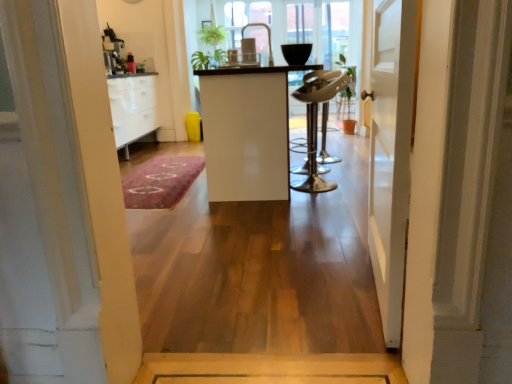
Measure the distance between white wooden door at center and camera.

1.20 meters.

What do you see at coordinates (161, 181) in the screenshot? This screenshot has width=512, height=384. I see `pink carpet at center` at bounding box center [161, 181].

This screenshot has height=384, width=512. Identify the location of shiny metallic bar stool at center. (316, 120).

Find the location of a particular element. This screenshot has height=384, width=512. furniture lying above the shiny metallic bar stool at center (from the image's perspective) is located at coordinates (247, 131).

Considering the relative sizes of shiny metallic bar stool at center and white glossy cabinet at center in the image provided, is shiny metallic bar stool at center wider than white glossy cabinet at center?

No, shiny metallic bar stool at center is not wider than white glossy cabinet at center.

What's the angular difference between shiny metallic bar stool at center and white glossy cabinet at center's facing directions?

179 degrees separate the facing orientations of shiny metallic bar stool at center and white glossy cabinet at center.

Does point (314, 150) come farther from viewer compared to point (240, 83)?

Yes, point (314, 150) is farther from viewer.

Considering the positions of point (186, 158) and point (388, 76), is point (186, 158) closer or farther from the camera than point (388, 76)?

Point (186, 158).

Is the position of pink carpet at center less distant than that of white wooden door at center?

No, pink carpet at center is further to the viewer.

Considering the sizes of pink carpet at center and white wooden door at center in the image, is pink carpet at center wider or thinner than white wooden door at center?

Clearly, pink carpet at center has more width compared to white wooden door at center.

Locate an element on the screen. door located in front of the pink carpet at center is located at coordinates (391, 153).

Locate an element on the screen. furniture on the right of pink carpet at center is located at coordinates (247, 131).

Can white glossy cabinet at center be found inside pink carpet at center?

No, white glossy cabinet at center is located outside of pink carpet at center.

Looking at the image, does pink carpet at center seem bigger or smaller compared to white glossy cabinet at center?

In the image, pink carpet at center appears to be smaller than white glossy cabinet at center.

Is point (166, 166) farther from viewer compared to point (219, 86)?

Yes.

Could shiny metallic bar stool at center be considered to be inside white wooden door at center?

That's incorrect, shiny metallic bar stool at center is not inside white wooden door at center.

Is white wooden door at center in front of or behind shiny metallic bar stool at center in the image?

white wooden door at center is positioned closer to the viewer than shiny metallic bar stool at center.

Can you confirm if white wooden door at center is shorter than shiny metallic bar stool at center?

No, white wooden door at center is not shorter than shiny metallic bar stool at center.

Would you consider shiny metallic bar stool at center to be distant from white wooden door at center?

shiny metallic bar stool at center is positioned a significant distance from white wooden door at center.

Do you think shiny metallic bar stool at center is within white wooden door at center, or outside of it?

shiny metallic bar stool at center lies outside white wooden door at center.

Is white wooden door at center at the back of shiny metallic bar stool at center?

shiny metallic bar stool at center does not have its back to white wooden door at center.

Between shiny metallic bar stool at center and white wooden door at center, which one is positioned behind?

shiny metallic bar stool at center is more distant.

Based on their positions, is white glossy cabinet at center located to the left or right of white wooden door at center?

From the image, it's evident that white glossy cabinet at center is to the left of white wooden door at center.

Do you think white glossy cabinet at center is within white wooden door at center, or outside of it?

white glossy cabinet at center is located beyond the bounds of white wooden door at center.

Looking at this image, from a real-world perspective, between white glossy cabinet at center and white wooden door at center, who is vertically higher?

white wooden door at center is physically above.

From the image's perspective, is shiny metallic bar stool at center under pink carpet at center?

No.

Choose the correct answer: Is shiny metallic bar stool at center inside pink carpet at center or outside it?

shiny metallic bar stool at center is outside pink carpet at center.

Is point (335, 86) farther from viewer compared to point (170, 194)?

That is False.

Find the location of `bar stool below the white glossy cabinet at center (from the image's perspective)`. bar stool below the white glossy cabinet at center (from the image's perspective) is located at coordinates (316, 120).

Find the location of a particular element. doormat below the white wooden door at center (from a real-world perspective) is located at coordinates (161, 181).

Estimate the real-world distances between objects in this image. Which object is further from white glossy cabinet at center, white wooden door at center or shiny metallic bar stool at center?

Among the two, white wooden door at center is located further to white glossy cabinet at center.

Which object lies further to the anchor point white wooden door at center, white glossy cabinet at center or pink carpet at center?

Result: pink carpet at center lies further to white wooden door at center than the other object.

Which object lies further to the anchor point white glossy cabinet at center, pink carpet at center or white wooden door at center?

The object further to white glossy cabinet at center is white wooden door at center.

Which object lies further to the anchor point shiny metallic bar stool at center, white glossy cabinet at center or white wooden door at center?

white wooden door at center lies further to shiny metallic bar stool at center than the other object.

Estimate the real-world distances between objects in this image. Which object is closer to white glossy cabinet at center, shiny metallic bar stool at center or white wooden door at center?

shiny metallic bar stool at center.

Estimate the real-world distances between objects in this image. Which object is further from white glossy cabinet at center, pink carpet at center or shiny metallic bar stool at center?

Based on the image, pink carpet at center appears to be further to white glossy cabinet at center.

Based on their spatial positions, is white glossy cabinet at center or pink carpet at center closer to shiny metallic bar stool at center?

Based on the image, white glossy cabinet at center appears to be nearer to shiny metallic bar stool at center.

Estimate the real-world distances between objects in this image. Which object is closer to pink carpet at center, white glossy cabinet at center or shiny metallic bar stool at center?

The object closer to pink carpet at center is white glossy cabinet at center.

Where is `furniture between pink carpet at center and shiny metallic bar stool at center in the horizontal direction`? The width and height of the screenshot is (512, 384). furniture between pink carpet at center and shiny metallic bar stool at center in the horizontal direction is located at coordinates (247, 131).

At what (x,y) coordinates should I click in order to perform the action: click on furniture positioned between white wooden door at center and pink carpet at center from near to far. Please return your answer as a coordinate pair (x, y). This screenshot has width=512, height=384. Looking at the image, I should click on (247, 131).

This screenshot has height=384, width=512. Find the location of `furniture between white wooden door at center and shiny metallic bar stool at center from front to back`. furniture between white wooden door at center and shiny metallic bar stool at center from front to back is located at coordinates (247, 131).

Find the location of `bar stool between white wooden door at center and pink carpet at center in the front-back direction`. bar stool between white wooden door at center and pink carpet at center in the front-back direction is located at coordinates (316, 120).